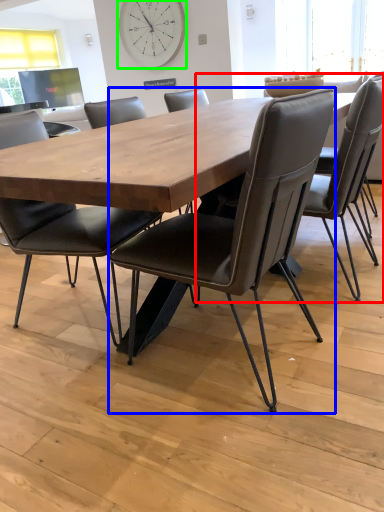
Question: Estimate the real-world distances between objects in this image. Which object is farther from chair (highlighted by a red box), chair (highlighted by a blue box) or clock (highlighted by a green box)?

Choices:
 (A) chair
 (B) clock

Answer: (B)